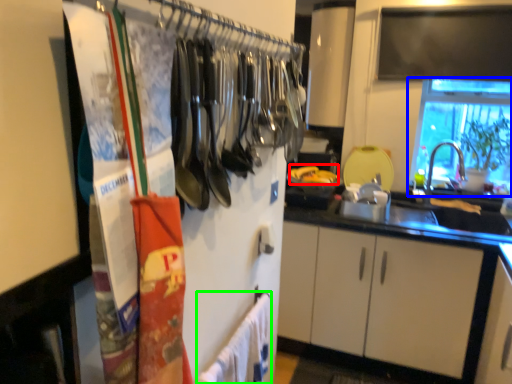
Question: Based on their relative distances, which object is nearer to food (highlighted by a red box)? Choose from window (highlighted by a blue box) and bath towel (highlighted by a green box).

Choices:
 (A) window
 (B) bath towel

Answer: (A)